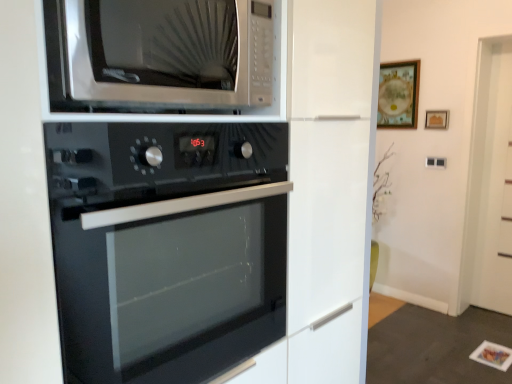
Question: Does black glass oven at center have a lesser width compared to satin silver microwave at upper center?

Choices:
 (A) yes
 (B) no

Answer: (B)

Question: Is black glass oven at center at the right side of satin silver microwave at upper center?

Choices:
 (A) yes
 (B) no

Answer: (A)

Question: Would you say black glass oven at center contains satin silver microwave at upper center?

Choices:
 (A) no
 (B) yes

Answer: (A)

Question: Considering the relative positions of black glass oven at center and satin silver microwave at upper center in the image provided, is black glass oven at center behind satin silver microwave at upper center?

Choices:
 (A) no
 (B) yes

Answer: (B)

Question: Is black glass oven at center with satin silver microwave at upper center?

Choices:
 (A) no
 (B) yes

Answer: (A)

Question: Considering their positions, is wooden framed picture at upper right, the 1th picture frame viewed from the left, located in front of or behind wooden frame at upper center, which is the first picture frame in right-to-left order?

Choices:
 (A) front
 (B) behind

Answer: (B)

Question: Based on their positions, is wooden framed picture at upper right, the 2th picture frame when ordered from right to left, located to the left or right of wooden frame at upper center, acting as the second picture frame starting from the left?

Choices:
 (A) left
 (B) right

Answer: (A)

Question: From a real-world perspective, is wooden framed picture at upper right, the 2th picture frame when ordered from right to left, positioned above or below wooden frame at upper center, which is the first picture frame in right-to-left order?

Choices:
 (A) below
 (B) above

Answer: (B)

Question: In terms of size, does wooden framed picture at upper right, the 1th picture frame viewed from the left, appear bigger or smaller than wooden frame at upper center, which is the first picture frame in right-to-left order?

Choices:
 (A) small
 (B) big

Answer: (B)

Question: Considering the positions of satin silver microwave at upper center and black glass oven at center in the image, is satin silver microwave at upper center wider or thinner than black glass oven at center?

Choices:
 (A) thin
 (B) wide

Answer: (A)

Question: Considering the positions of point (176, 69) and point (173, 231), is point (176, 69) closer or farther from the camera than point (173, 231)?

Choices:
 (A) farther
 (B) closer

Answer: (B)

Question: Based on their sizes in the image, would you say satin silver microwave at upper center is bigger or smaller than black glass oven at center?

Choices:
 (A) small
 (B) big

Answer: (A)

Question: Would you say satin silver microwave at upper center is inside or outside black glass oven at center?

Choices:
 (A) outside
 (B) inside

Answer: (A)

Question: Is black glass oven at center bigger or smaller than satin silver microwave at upper center?

Choices:
 (A) small
 (B) big

Answer: (B)

Question: Would you say black glass oven at center is to the left or to the right of satin silver microwave at upper center in the picture?

Choices:
 (A) left
 (B) right

Answer: (B)